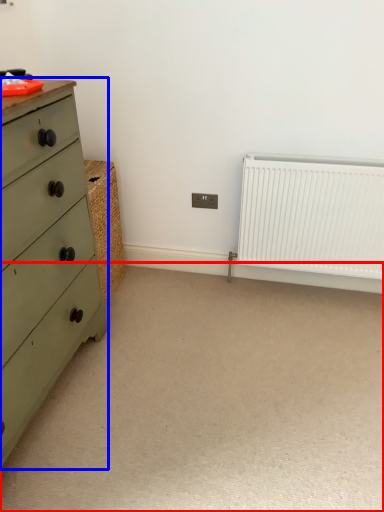
Question: Which object is further to the camera taking this photo, plain (highlighted by a red box) or chest of drawers (highlighted by a blue box)?

Choices:
 (A) plain
 (B) chest of drawers

Answer: (A)